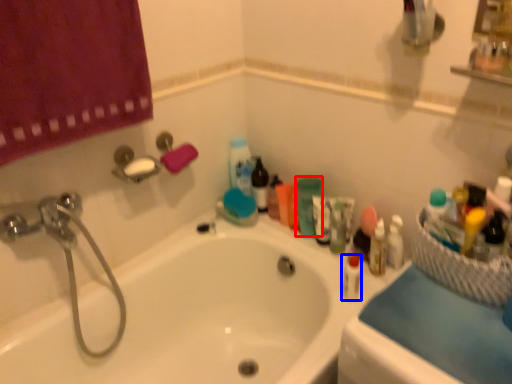
Question: Which point is closer to the camera, toiletry (highlighted by a red box) or mouthwash (highlighted by a blue box)?

Choices:
 (A) toiletry
 (B) mouthwash

Answer: (B)